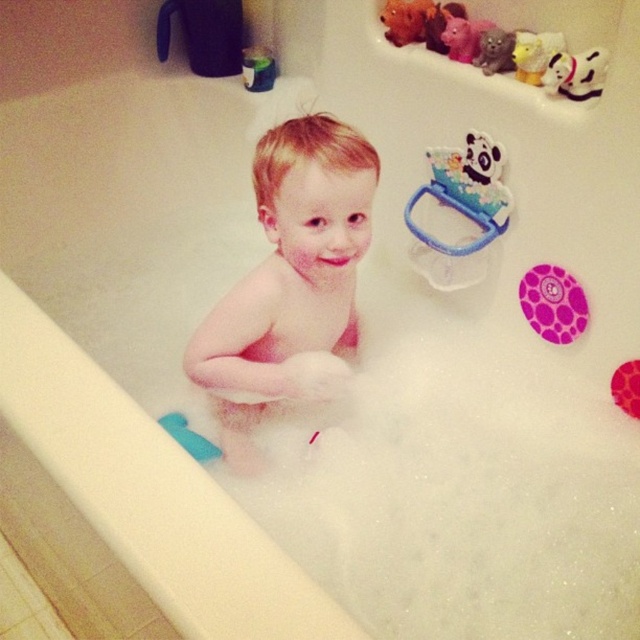
Is point (570, 285) farther from camera compared to point (564, 96)?

That is True.

Does point (582, 307) come in front of point (579, 93)?

No, it is behind (579, 93).

Which is behind, point (538, 316) or point (602, 52)?

Positioned behind is point (538, 316).

Find the location of a particular element. The image size is (640, 640). purple dotted rubber ring at upper right is located at coordinates [552, 304].

Which is below, pink matte toddler at center or white rubber duck at upper right?

Positioned lower is pink matte toddler at center.

Is pink matte toddler at center above white rubber duck at upper right?

No, pink matte toddler at center is not above white rubber duck at upper right.

In order to click on pink matte toddler at center in this screenshot , I will do [x=291, y=282].

Which is in front, point (340, 353) or point (560, 282)?

Point (560, 282) is more forward.

Looking at this image, is pink matte toddler at center below purple dotted rubber ring at upper right?

Incorrect, pink matte toddler at center is not positioned below purple dotted rubber ring at upper right.

Which is behind, point (259, 220) or point (547, 326)?

The point (547, 326) is behind.

The width and height of the screenshot is (640, 640). I want to click on pink matte toddler at center, so click(x=291, y=282).